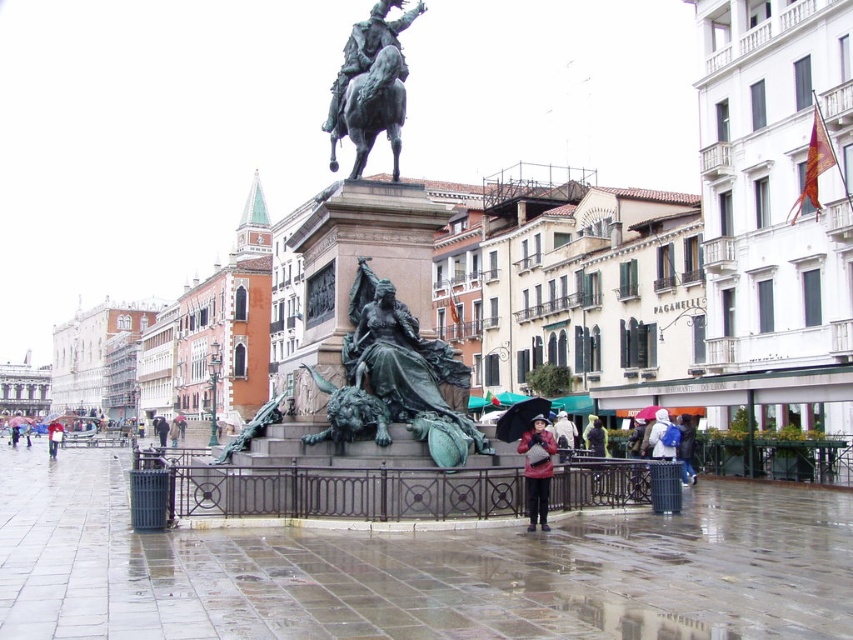
Does bronze statue at center have a lesser width compared to red jacket at lower left?

Yes.

Is point (379, 4) farther from viewer compared to point (56, 440)?

No, it is in front of (56, 440).

Describe the element at coordinates (370, 84) in the screenshot. I see `bronze statue at center` at that location.

This screenshot has width=853, height=640. I want to click on bronze statue at center, so click(x=370, y=84).

From the picture: Can you confirm if matte red coat at lower center is bigger than black matte umbrella at lower center?

Incorrect, matte red coat at lower center is not larger than black matte umbrella at lower center.

Who is positioned more to the right, matte red coat at lower center or black matte umbrella at lower center?

black matte umbrella at lower center

Find the location of a particular element. This screenshot has height=640, width=853. matte red coat at lower center is located at coordinates (537, 468).

Can you confirm if blue fabric umbrella at lower right is thinner than raincoat matte at lower left?

Correct, blue fabric umbrella at lower right's width is less than raincoat matte at lower left's.

Which is behind, point (677, 422) or point (22, 428)?

The point (22, 428) is behind.

The image size is (853, 640). I want to click on blue fabric umbrella at lower right, so click(686, 448).